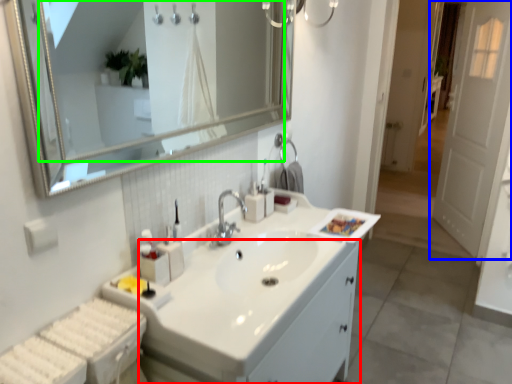
Question: Which is farther away from bathroom cabinet (highlighted by a red box)? door (highlighted by a blue box) or mirror (highlighted by a green box)?

Choices:
 (A) door
 (B) mirror

Answer: (B)